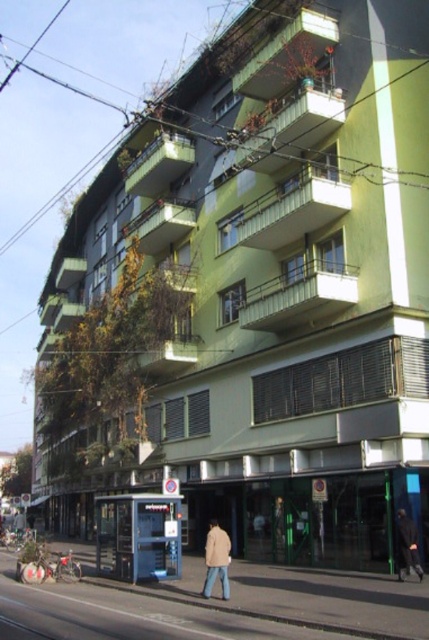
Based on the photo, can you confirm if beige fabric jacket at lower center is positioned to the right of dark fabric jacket at lower right?

Incorrect, beige fabric jacket at lower center is not on the right side of dark fabric jacket at lower right.

Can you confirm if beige fabric jacket at lower center is positioned below dark fabric jacket at lower right?

Correct, beige fabric jacket at lower center is located below dark fabric jacket at lower right.

Find the location of a particular element. Image resolution: width=429 pixels, height=640 pixels. beige fabric jacket at lower center is located at coordinates (217, 560).